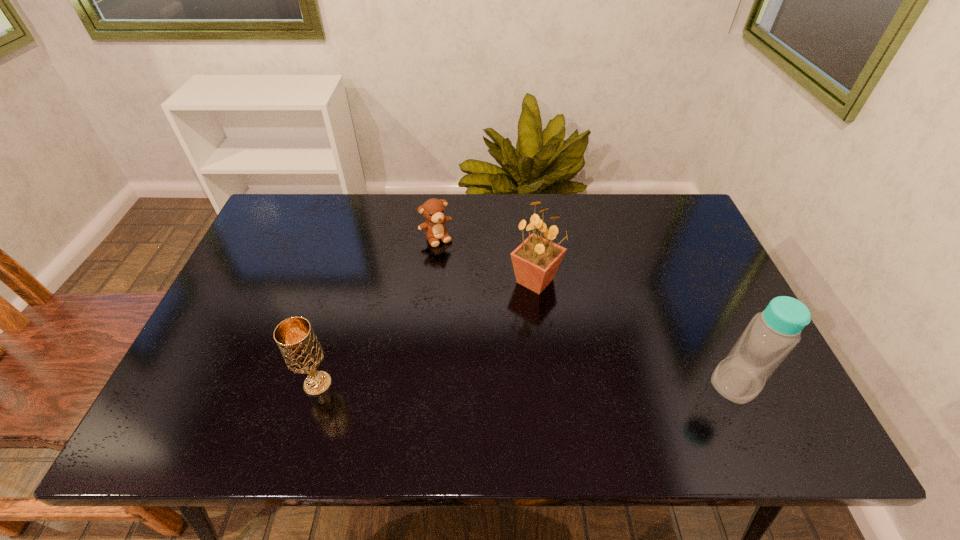
Where is `free space between the third object from left to right and the shortest object`? free space between the third object from left to right and the shortest object is located at coordinates (486, 259).

I want to click on free space between the rightmost object and the teddy bear, so click(x=586, y=310).

What are the coordinates of `unoccupied position between the chalice and the sunflower` in the screenshot? It's located at (426, 332).

This screenshot has height=540, width=960. In order to click on free point between the rightmost object and the teddy bear in this screenshot , I will do pyautogui.click(x=586, y=310).

Locate an element on the screen. free point between the farthest object and the leftmost object is located at coordinates click(376, 311).

Identify the location of free point between the shortest object and the bottle. The height and width of the screenshot is (540, 960). (586, 310).

The image size is (960, 540). What are the coordinates of `object that is the third closest one to the sunflower` in the screenshot? It's located at (295, 338).

Locate which object is the closest to the sunflower. Please provide its 2D coordinates. Your answer should be formatted as a tuple, i.e. [(x, y)], where the tuple contains the x and y coordinates of a point satisfying the conditions above.

[(433, 210)]

Find the location of a particular element. vacant space that satisfies the following two spatial constraints: 1. on the front side of the sunflower; 2. on the right side of the rightmost object is located at coordinates (547, 383).

The width and height of the screenshot is (960, 540). In order to click on vacant space that satisfies the following two spatial constraints: 1. on the back side of the farthest object; 2. on the left side of the third tallest object in this screenshot , I will do 360,238.